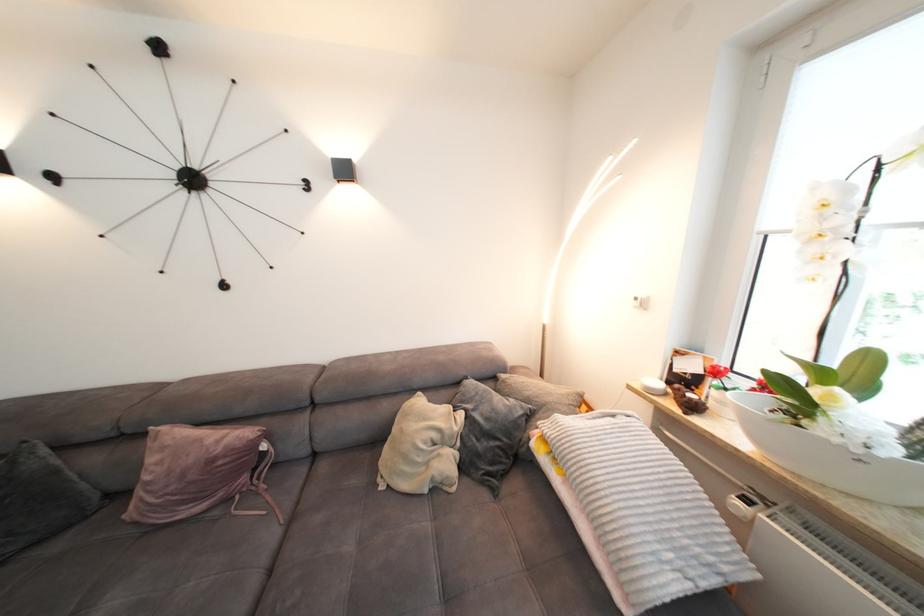
Which object does [638,511] point to?

It refers to a folded striped blanket.